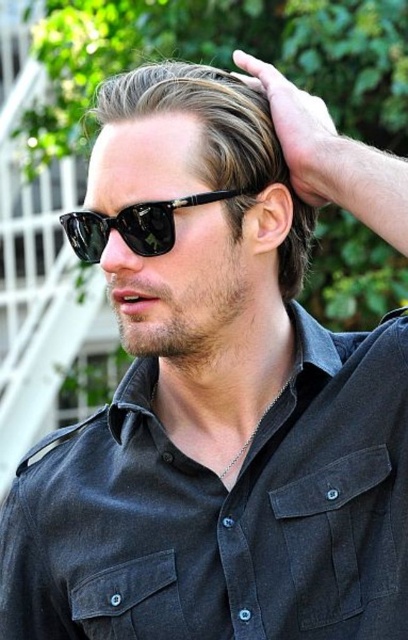
Question: Is black shiny sunglasses at center above black leather hand at upper center?

Choices:
 (A) yes
 (B) no

Answer: (B)

Question: Which of these objects is positioned farthest from the black leather hand at upper center?

Choices:
 (A) black shiny sunglasses at center
 (B) black shiny sunglasses at upper center

Answer: (B)

Question: Among these points, which one is nearest to the camera?

Choices:
 (A) (308, 102)
 (B) (170, 200)

Answer: (B)

Question: Which point is farther to the camera?

Choices:
 (A) (254, 198)
 (B) (334, 132)

Answer: (B)

Question: Does black shiny sunglasses at center appear under black shiny sunglasses at upper center?

Choices:
 (A) yes
 (B) no

Answer: (B)

Question: Can you confirm if black shiny sunglasses at center is wider than black leather hand at upper center?

Choices:
 (A) no
 (B) yes

Answer: (B)